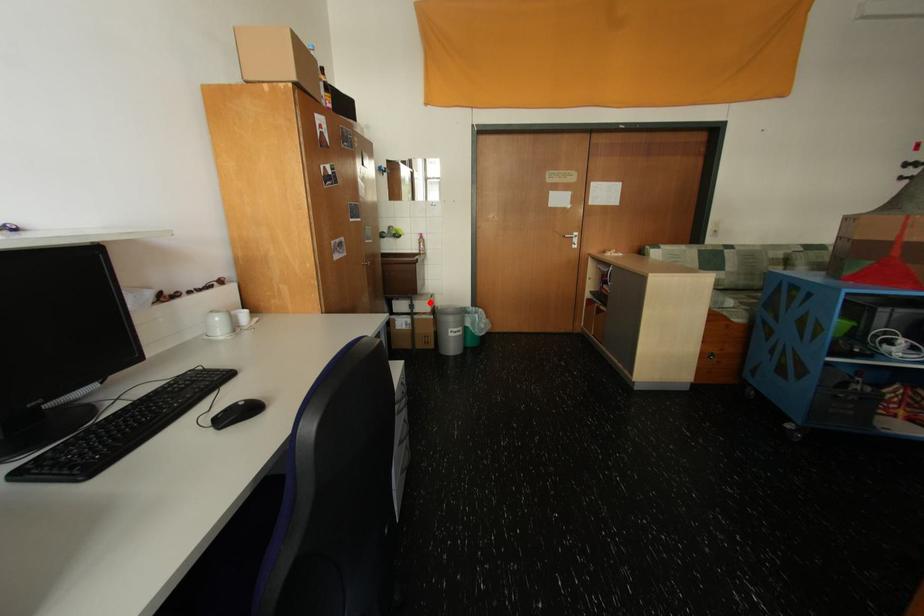
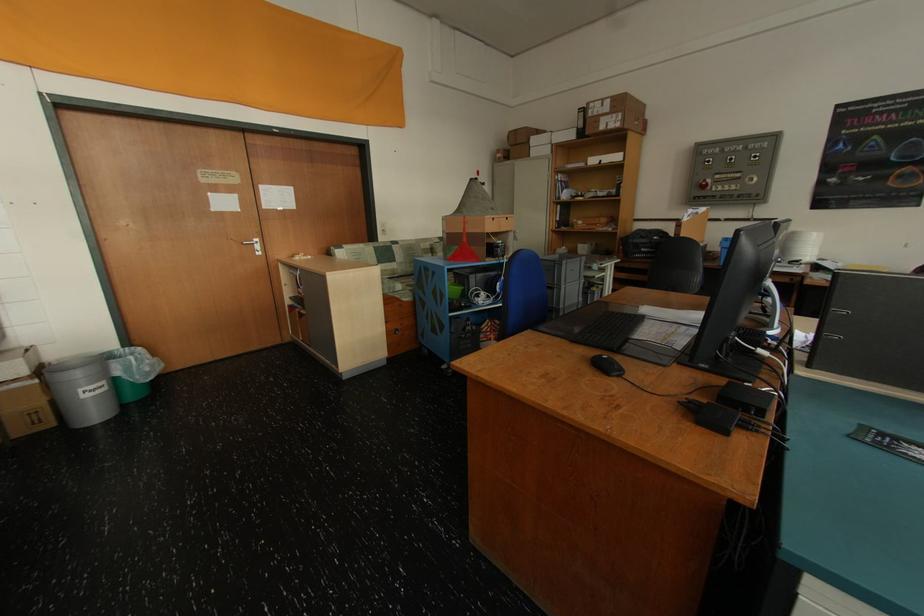
Question: I am providing you with two images of the same scene from different viewpoints. A red point is shown in image1. For the corresponding object point in image2, is it positioned nearer or farther from the camera?

Choices:
 (A) Nearer
 (B) Farther

Answer: (B)